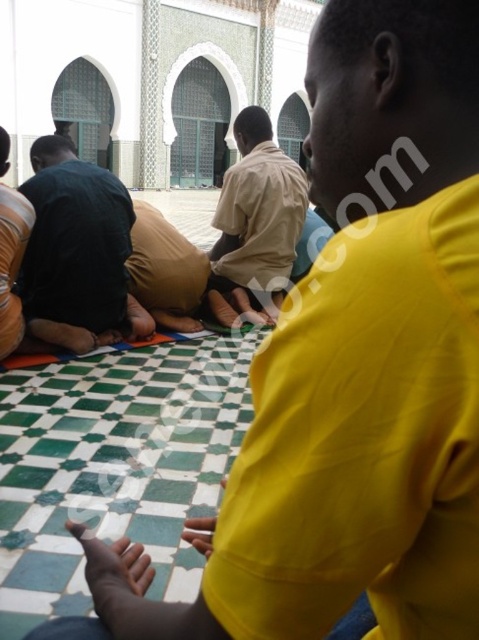
Question: Which object is the closest to the beige cotton shirt at center?

Choices:
 (A) dark blue fabric at center
 (B) dark brown leather shoes at lower left

Answer: (A)

Question: Which object is the closest to the dark brown leather shoes at lower left?

Choices:
 (A) dark blue fabric at center
 (B) beige cotton shirt at center

Answer: (A)

Question: Considering the relative positions of dark blue fabric at center and dark brown leather shoes at lower left in the image provided, where is dark blue fabric at center located with respect to dark brown leather shoes at lower left?

Choices:
 (A) right
 (B) left

Answer: (A)

Question: Which object is positioned farthest from the beige cotton shirt at center?

Choices:
 (A) dark brown leather shoes at lower left
 (B) dark blue fabric at center

Answer: (A)

Question: Can you confirm if dark blue fabric at center is positioned below beige cotton shirt at center?

Choices:
 (A) yes
 (B) no

Answer: (A)

Question: Considering the relative positions of beige cotton shirt at center and dark brown leather shoes at lower left in the image provided, where is beige cotton shirt at center located with respect to dark brown leather shoes at lower left?

Choices:
 (A) above
 (B) below

Answer: (A)